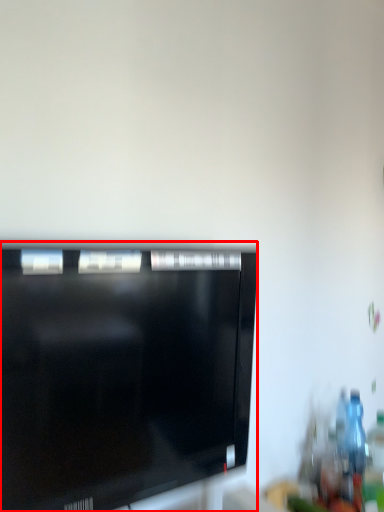
Question: Observing the image, what is the correct spatial positioning of television (annotated by the red box) in reference to bottle?

Choices:
 (A) right
 (B) left

Answer: (B)